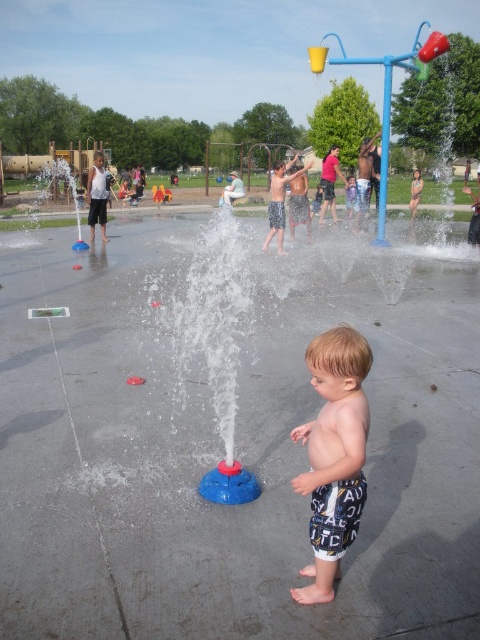
Question: Does light brown hair at center appear on the left side of smooth skin child at center?

Choices:
 (A) no
 (B) yes

Answer: (B)

Question: Does light brown hair at center appear on the left side of smooth skin child at center?

Choices:
 (A) yes
 (B) no

Answer: (A)

Question: Among these objects, which one is farthest from the camera?

Choices:
 (A) light brown hair at center
 (B) smooth skin child at center

Answer: (B)

Question: Which point is farther to the camera?

Choices:
 (A) (355, 536)
 (B) (272, 214)

Answer: (B)

Question: Among these objects, which one is nearest to the camera?

Choices:
 (A) smooth skin child at center
 (B) light brown hair at center

Answer: (B)

Question: Is light brown hair at center above smooth skin child at center?

Choices:
 (A) yes
 (B) no

Answer: (B)